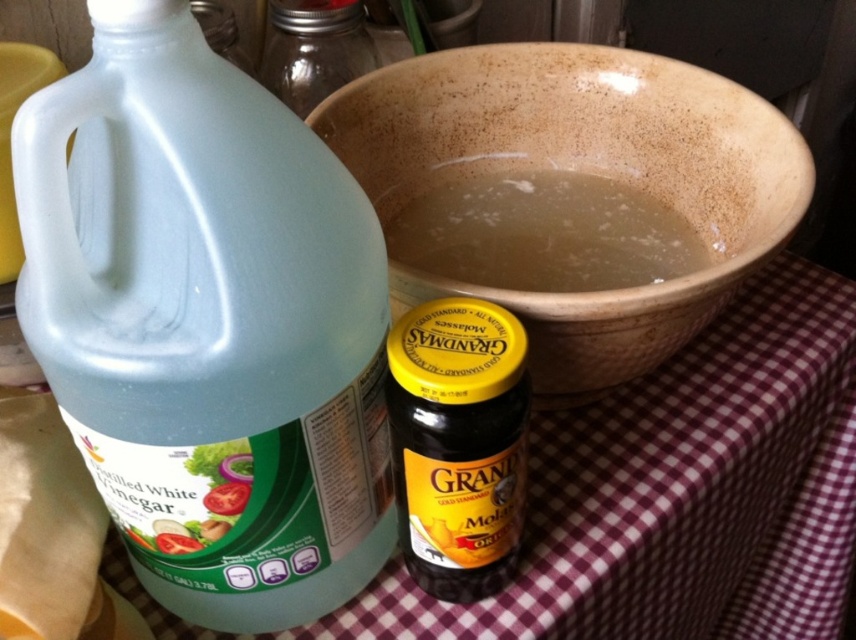
Question: Which object is farther from the camera taking this photo?

Choices:
 (A) clear glass jar at upper center
 (B) translucent plastic bottle at left
 (C) brown stoneware bowl at center

Answer: (A)

Question: Which object appears closest to the camera in this image?

Choices:
 (A) translucent plastic bottle at left
 (B) clear glass jar at upper center
 (C) brown translucent liquid at center

Answer: (A)

Question: Is yellow-golden plastic jar at center below brown translucent liquid at center?

Choices:
 (A) yes
 (B) no

Answer: (A)

Question: Which object is positioned closest to the clear glass jar at upper center?

Choices:
 (A) brown translucent liquid at center
 (B) translucent plastic bottle at left

Answer: (A)

Question: Is brown stoneware bowl at center smaller than clear glass jar at upper center?

Choices:
 (A) yes
 (B) no

Answer: (B)

Question: Can you confirm if yellow-golden plastic jar at center is positioned to the left of brown translucent liquid at center?

Choices:
 (A) no
 (B) yes

Answer: (B)